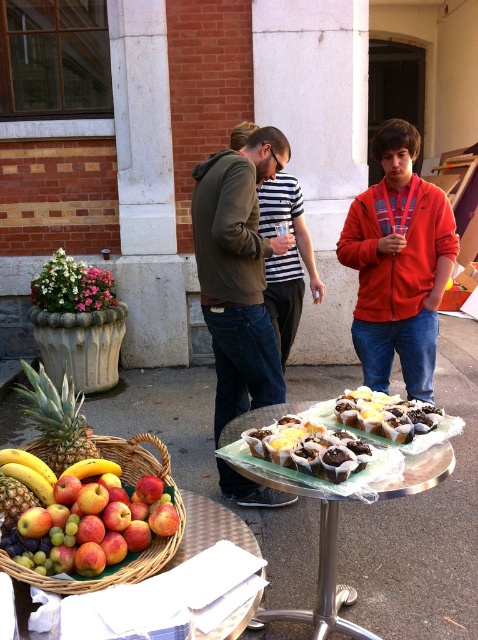
You are standing at the entrance of the building and want to find the matte brown hoodie at center. According to the scene description, where should you look relative to the tables?

The matte brown hoodie at center is located at point (x=239, y=273), which is at the center of the image. Since the scene has a round table with a white cloth and fruits in the foreground and another table to the right with a silver foil sheet, the hoodie is likely positioned centrally between or near these tables.

You are a guest at this outdoor event and want to grab the chocolate cake at center. There is a matte brown hoodie at center in the way. Can you reach the cake without moving the hoodie?

The matte brown hoodie at center is above the chocolate cake at center, so you cannot reach the cake without moving the hoodie.

You are a photographer positioned at the edge of the scene. You want to capture a photo that includes both the matte brown hoodie at center and the woven brown basket at lower left. Which object should you adjust your camera angle to include first if it is currently out of frame?

The woven brown basket at lower left is behind the matte brown hoodie at center, so you should adjust your camera angle to include the woven brown basket at lower left first since it is farther back and might be more challenging to frame alongside the hoodie.